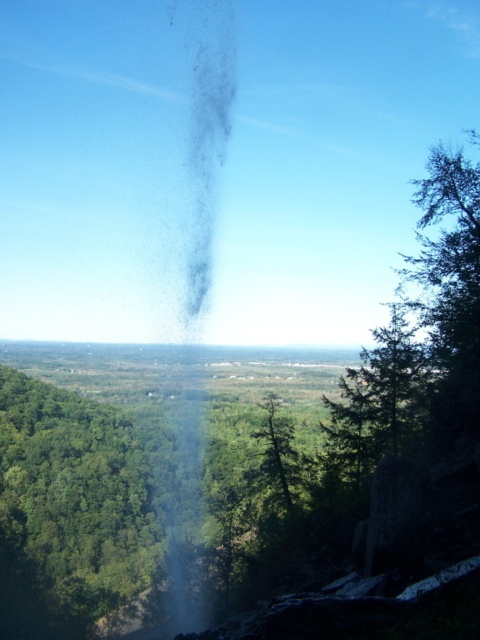
Between green leafy tree at left and green matte tree at center, which one is positioned higher?

green matte tree at center is higher up.

Is green leafy tree at left to the left of green matte tree at center from the viewer's perspective?

Correct, you'll find green leafy tree at left to the left of green matte tree at center.

Does point (100, 588) come in front of point (288, 504)?

No.

Locate an element on the screen. green leafy tree at left is located at coordinates [70, 512].

What do you see at coordinates (70, 512) in the screenshot? This screenshot has width=480, height=640. I see `green leafy tree at left` at bounding box center [70, 512].

Can you confirm if green leafy tree at left is positioned above smoketransparentat center?

Actually, green leafy tree at left is below smoketransparentat center.

Is point (94, 600) in front of point (191, 368)?

Yes.

Where is `green leafy tree at left`? green leafy tree at left is located at coordinates (x=70, y=512).

From the picture: Does smoketransparentat center appear over green matte tree at center?

Yes, smoketransparentat center is above green matte tree at center.

Does smoketransparentat center have a lesser height compared to green matte tree at center?

No.

Find the location of `smoketransparentat center`. smoketransparentat center is located at coordinates (196, 294).